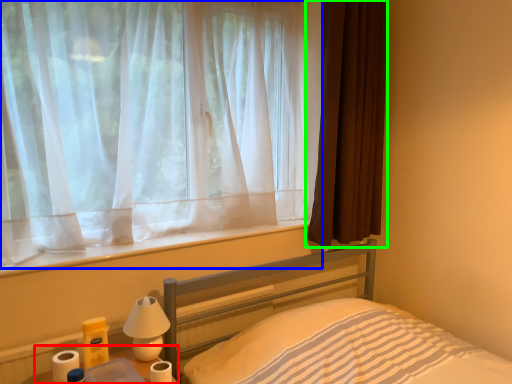
Question: Based on their relative distances, which object is farther from table (highlighted by a red box)? Choose from curtain (highlighted by a blue box) and curtain (highlighted by a green box).

Choices:
 (A) curtain
 (B) curtain

Answer: (B)